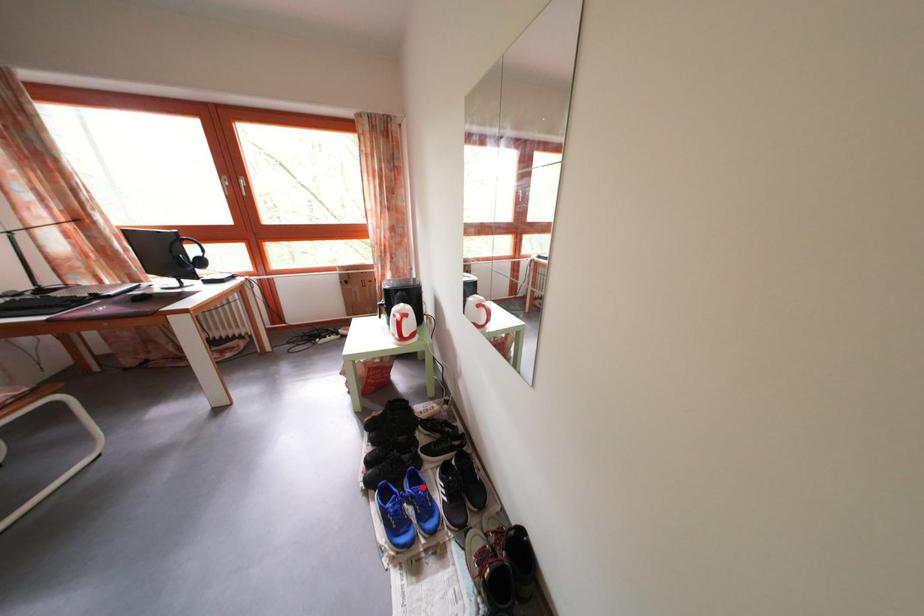
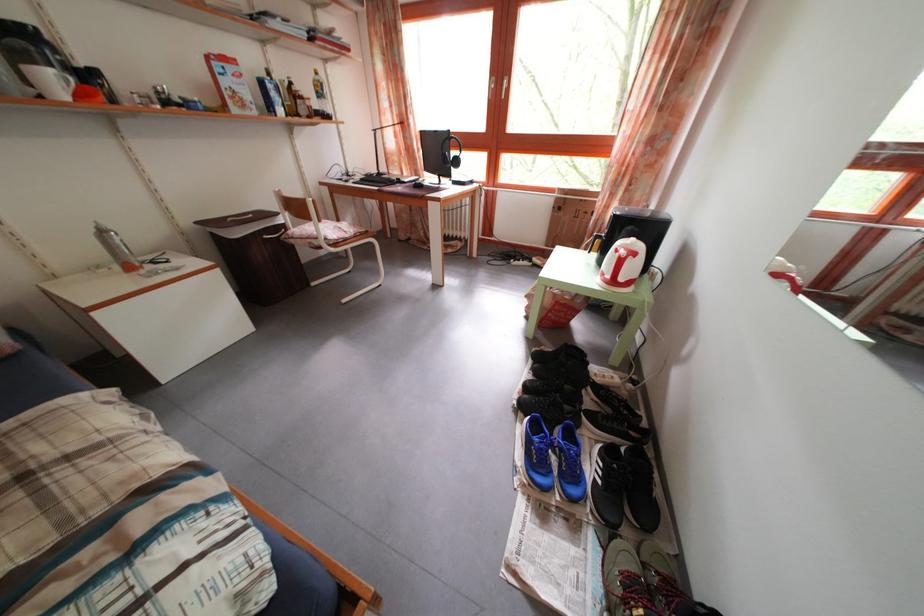
Question: A red point is marked in image1. In image2, is the corresponding 3D point closer to the camera or farther? Reply with the corresponding letter.

Choices:
 (A) The corresponding 3D point is closer.
 (B) The corresponding 3D point is farther.

Answer: (A)